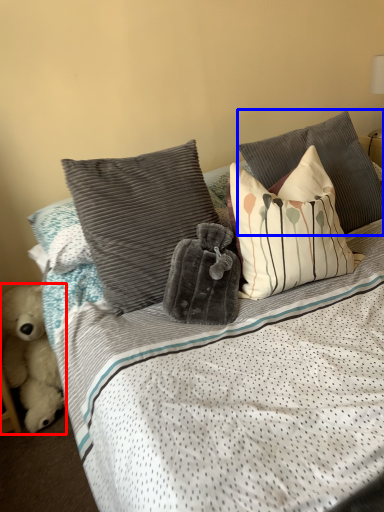
Question: Among these objects, which one is nearest to the camera, teddy bear (highlighted by a red box) or pillow (highlighted by a blue box)?

Choices:
 (A) teddy bear
 (B) pillow

Answer: (B)